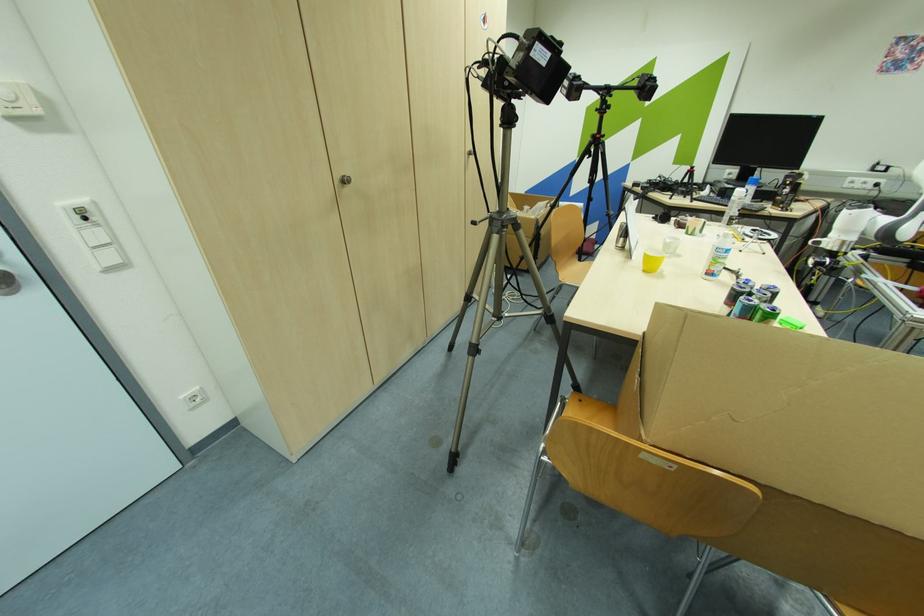
Find where to pull the silver cabinet knob. Please return your answer as a coordinate pair (x, y).

(345, 180)